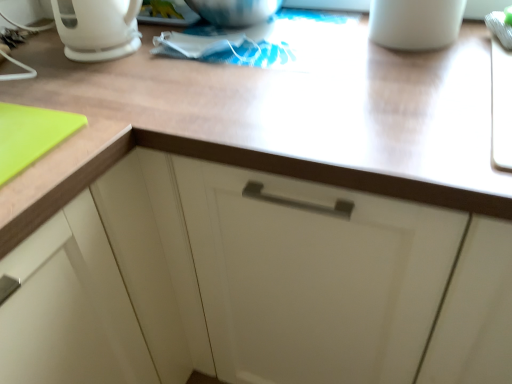
Question: Is wooden at upper center not inside white glossy coffee pot at upper left?

Choices:
 (A) yes
 (B) no

Answer: (A)

Question: Is wooden at upper center facing away from white glossy coffee pot at upper left?

Choices:
 (A) no
 (B) yes

Answer: (A)

Question: Does wooden at upper center have a smaller size compared to white glossy coffee pot at upper left?

Choices:
 (A) no
 (B) yes

Answer: (A)

Question: From the image's perspective, does wooden at upper center appear lower than white glossy coffee pot at upper left?

Choices:
 (A) no
 (B) yes

Answer: (B)

Question: Is wooden at upper center touching white glossy coffee pot at upper left?

Choices:
 (A) yes
 (B) no

Answer: (B)

Question: In the image, is white glossy coffee pot at upper left positioned in front of or behind wooden at upper center?

Choices:
 (A) behind
 (B) front

Answer: (A)

Question: Is point (132, 16) closer or farther from the camera than point (394, 140)?

Choices:
 (A) farther
 (B) closer

Answer: (A)

Question: From a real-world perspective, is white glossy coffee pot at upper left above or below wooden at upper center?

Choices:
 (A) below
 (B) above

Answer: (B)

Question: Visually, is white glossy coffee pot at upper left positioned to the left or to the right of wooden at upper center?

Choices:
 (A) left
 (B) right

Answer: (A)

Question: From the image's perspective, is white matte mug at upper right above or below white glossy coffee pot at upper left?

Choices:
 (A) below
 (B) above

Answer: (B)

Question: Considering their positions, is white matte mug at upper right located in front of or behind white glossy coffee pot at upper left?

Choices:
 (A) behind
 (B) front

Answer: (B)

Question: In terms of width, does white matte mug at upper right look wider or thinner when compared to white glossy coffee pot at upper left?

Choices:
 (A) wide
 (B) thin

Answer: (A)

Question: Does point (417, 8) appear closer or farther from the camera than point (125, 16)?

Choices:
 (A) farther
 (B) closer

Answer: (B)

Question: In the image, is white glossy coffee pot at upper left positioned in front of or behind white matte mug at upper right?

Choices:
 (A) behind
 (B) front

Answer: (A)

Question: In terms of width, does white glossy coffee pot at upper left look wider or thinner when compared to white matte mug at upper right?

Choices:
 (A) thin
 (B) wide

Answer: (A)